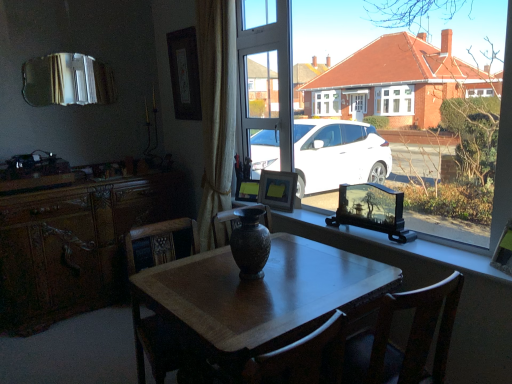
Question: Is silver reflective mirror at upper left spatially inside matte black picture frame at center, which is the 3th picture frame in top-to-bottom order, or outside of it?

Choices:
 (A) outside
 (B) inside

Answer: (A)

Question: In the image, is silver reflective mirror at upper left on the left side or the right side of matte black picture frame at center, which is the 3th picture frame in top-to-bottom order?

Choices:
 (A) right
 (B) left

Answer: (B)

Question: Which object is the closest to the wooden cabinet at left?

Choices:
 (A) wooden picture frame at window, the 4th picture frame when ordered from left to right
 (B) matte brown vase at center
 (C) wooden chair at center
 (D) wooden desk at center
 (E) matte black picture frame at center, the second picture frame viewed from the back

Answer: (C)

Question: Estimate the real-world distances between objects in this image. Which object is closer to the wooden chair at center?

Choices:
 (A) matte brown vase at center
 (B) wooden desk at center
 (C) wooden picture frame at window, the 1th picture frame viewed from the right
 (D) matte brown vase at center
 (E) wooden cabinet at left

Answer: (B)